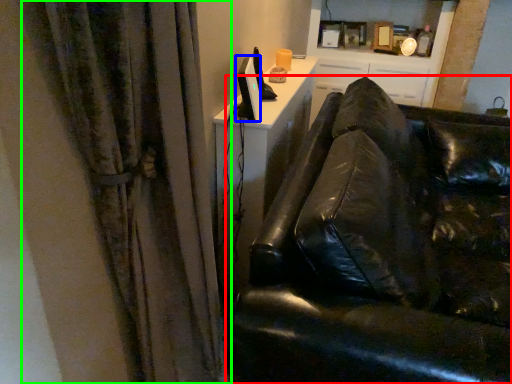
Question: Which is nearer to the studio couch (highlighted by a red box)? computer monitor (highlighted by a blue box) or curtain (highlighted by a green box).

Choices:
 (A) computer monitor
 (B) curtain

Answer: (B)